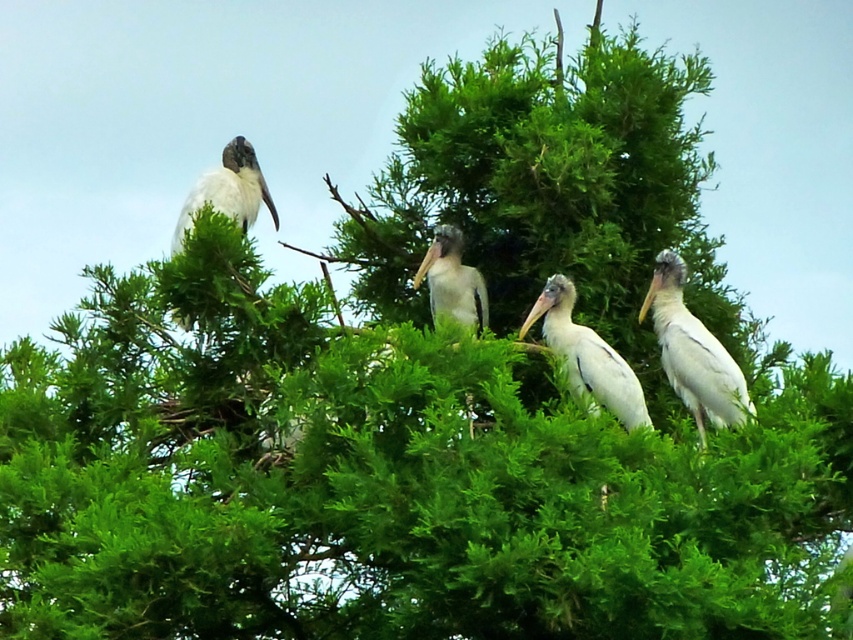
Question: Where is white matte stork at upper right located in relation to white feathered bird at center in the image?

Choices:
 (A) left
 (B) right

Answer: (B)

Question: Which is nearer to the white matte stork at center?

Choices:
 (A) white feathered bird at center
 (B) white matte stork at upper left

Answer: (A)

Question: Which object appears closest to the camera in this image?

Choices:
 (A) white matte stork at center
 (B) white matte stork at upper right

Answer: (A)

Question: From the image, what is the correct spatial relationship of white matte stork at center in relation to white matte stork at upper left?

Choices:
 (A) left
 (B) right

Answer: (B)

Question: Does white matte stork at center appear on the right side of white matte stork at upper left?

Choices:
 (A) yes
 (B) no

Answer: (A)

Question: Which of these objects is positioned farthest from the white matte stork at upper right?

Choices:
 (A) white matte stork at upper left
 (B) white matte stork at center

Answer: (A)